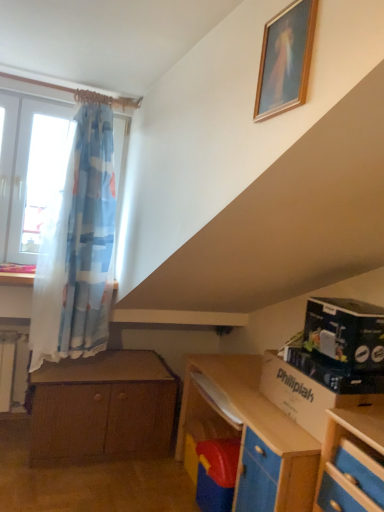
Question: In terms of height, does black cardboard box at right look taller or shorter compared to cardboard box at lower right?

Choices:
 (A) tall
 (B) short

Answer: (A)

Question: In terms of width, does black cardboard box at right look wider or thinner when compared to cardboard box at lower right?

Choices:
 (A) wide
 (B) thin

Answer: (A)

Question: Considering the real-world distances, which object is farthest from the wooden picture frame at upper center?

Choices:
 (A) black cardboard box at right
 (B) cardboard box at lower right
 (C) brown wooden chest of drawers at lower left

Answer: (C)

Question: Based on their relative distances, which object is farther from the cardboard box at lower right?

Choices:
 (A) brown wooden chest of drawers at lower left
 (B) black cardboard box at right
 (C) wooden picture frame at upper center

Answer: (C)